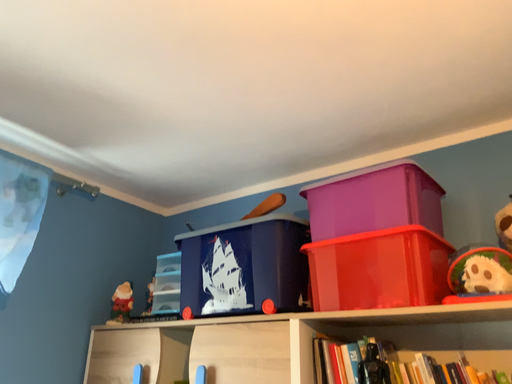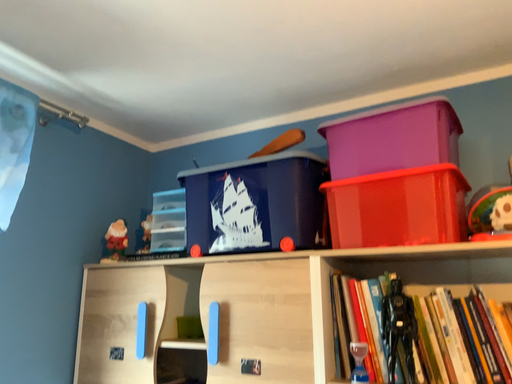
Question: Which way did the camera rotate in the video?

Choices:
 (A) rotated right
 (B) rotated left

Answer: (A)